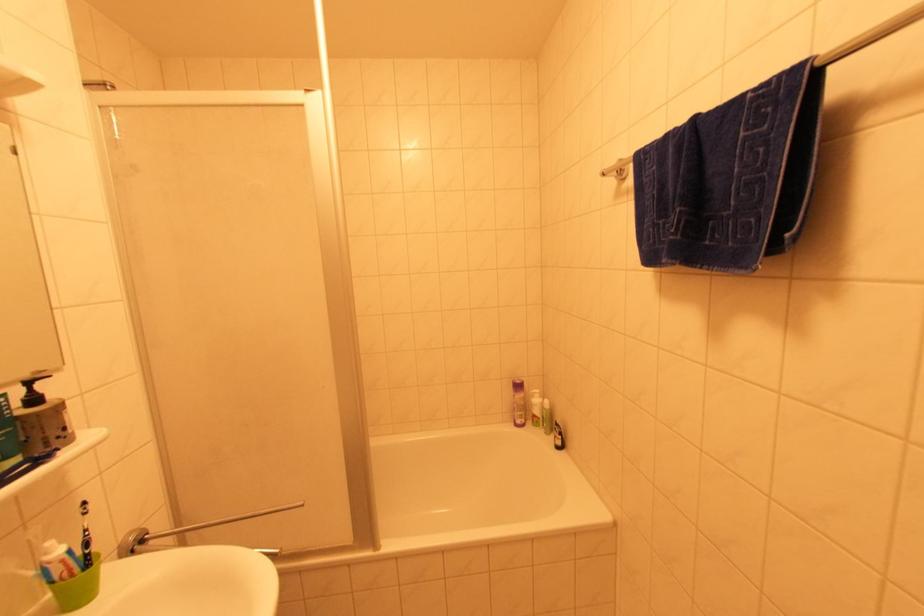
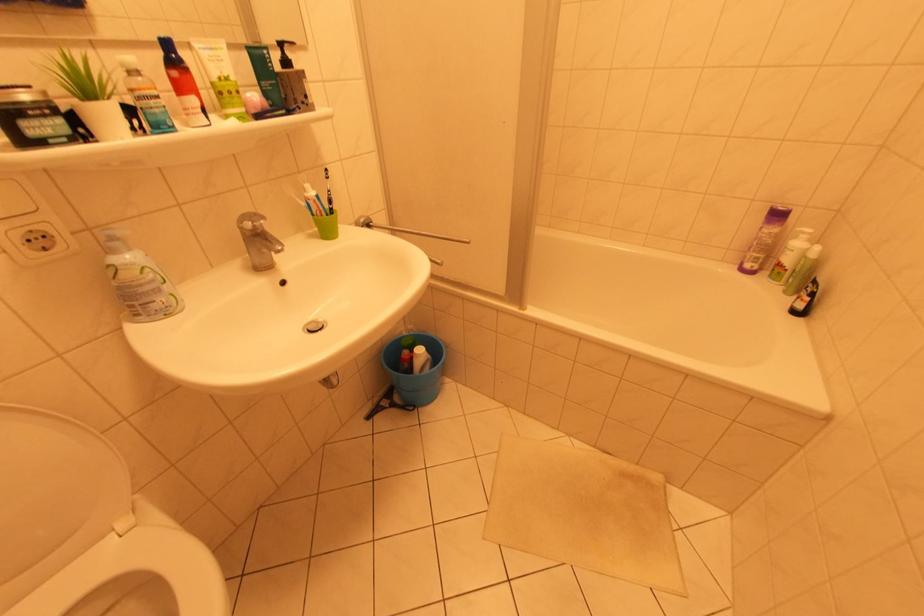
How did the camera likely rotate?

The camera's rotation is toward left-down.